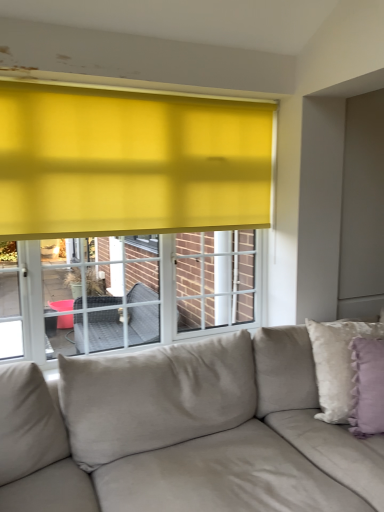
Question: In terms of size, does fluffy white pillow at right, the 1th pillow positioned from the back, appear bigger or smaller than lavender velvet pillow at right, which appears as the 1th pillow when viewed from the front?

Choices:
 (A) small
 (B) big

Answer: (B)

Question: Relative to lavender velvet pillow at right, placed as the 2th pillow when sorted from back to front, is fluffy white pillow at right, the 1th pillow positioned from the back, in front or behind?

Choices:
 (A) front
 (B) behind

Answer: (B)

Question: Considering the real-world distances, which object is closest to the suede-like beige couch at lower center?

Choices:
 (A) lavender velvet pillow at right, which appears as the 1th pillow when viewed from the front
 (B) fluffy white pillow at right, the 1th pillow positioned from the back

Answer: (B)

Question: Estimate the real-world distances between objects in this image. Which object is closer to the suede-like beige couch at lower center?

Choices:
 (A) lavender velvet pillow at right, placed as the 2th pillow when sorted from back to front
 (B) fluffy white pillow at right, the 1th pillow positioned from the back

Answer: (B)